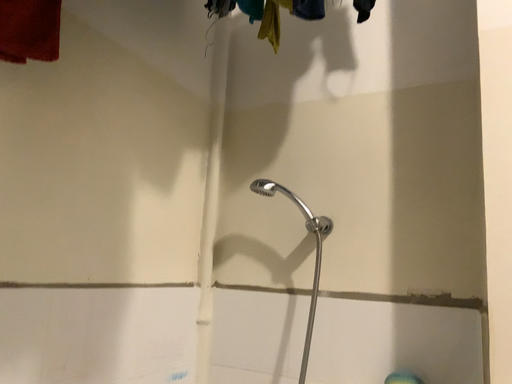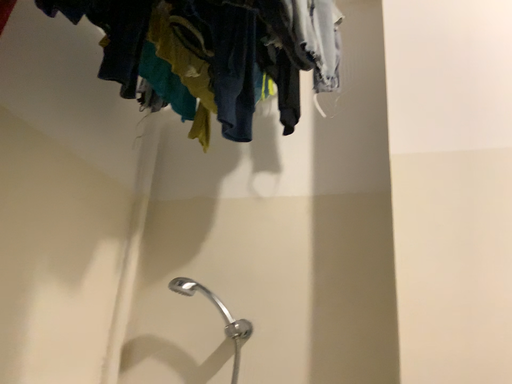
Question: How did the camera likely rotate when shooting the video?

Choices:
 (A) rotated right
 (B) rotated left

Answer: (A)